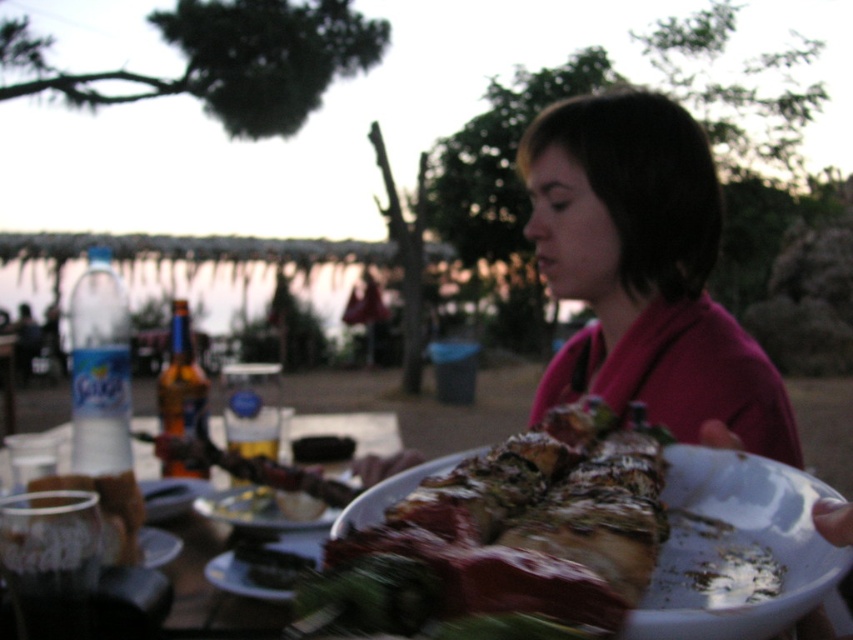
You are a guest at this outdoor dinner and want to grab the shiny metallic roast at center and the translucent glass cup at lower left. Which one do you need to reach further to get?

The translucent glass cup at lower left requires reaching further because it is farther from the viewer compared to the shiny metallic roast at center.

You are a drone operator trying to deliver a small package to the table in the scene. The coordinates for the table are at point 0.8, 0.6. Is the shiny metallic roast at center positioned to the northeast of the table coordinates?

The shiny metallic roast at center is located at point (509, 532), which is slightly to the east and north of the table coordinates at (511, 512). Therefore, yes, it is positioned to the northeast of the table coordinates.